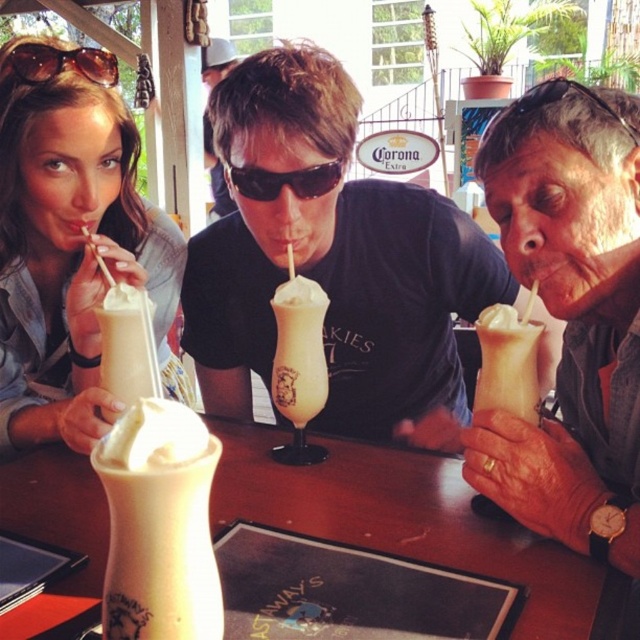
You are a food delivery person who needs to place an order for three milkshakes. The customer specified that the matte cream milkshake at left must be placed in the cooler at position A, which is located at coordinates (x=70, y=241). Can you confirm if the matte cream milkshake at left is already at the correct coordinates?

Yes, the matte cream milkshake at left is already at the correct coordinates (x=70, y=241) as specified.

You are a customer at this outdoor dining spot and notice two items on the table. The first is a whipped cream topped glass at right, and the second is a black plastic goggles at upper right. Which item is positioned closer to the left side of the table?

The whipped cream topped glass at right is positioned to the left of the black plastic goggles at upper right, so it is closer to the left side of the table.